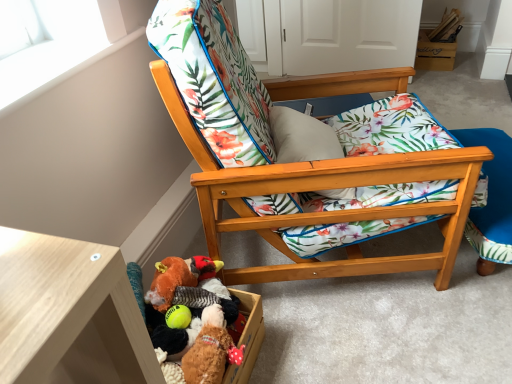
What are the coordinates of `free space in front of wooden box at upper right` in the screenshot? It's located at (444, 75).